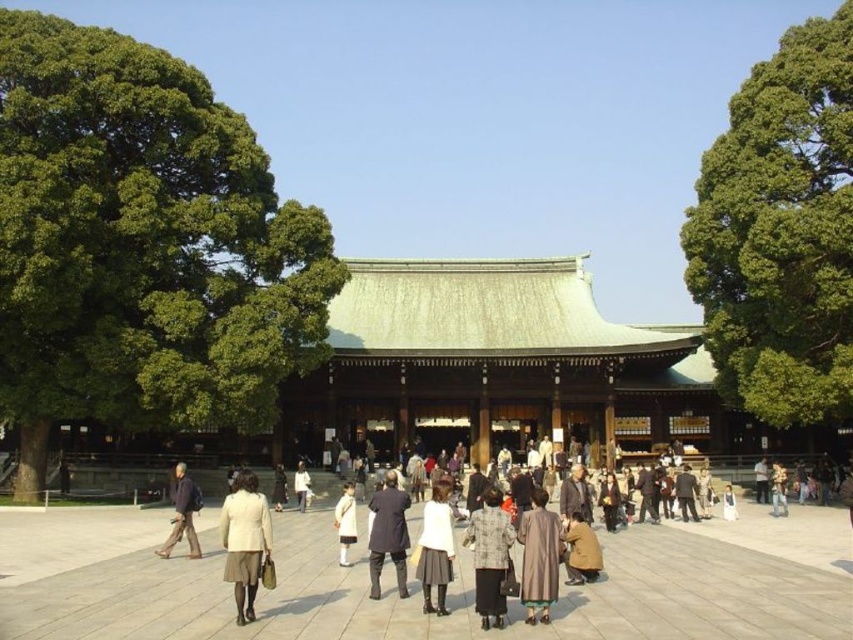
You are a photographer positioned at the entrance of the shrine. You want to take a photo of both the brown textured coat at center and the white matte coat at center. Which coat should you adjust to ensure both are fully visible in the photo?

The brown textured coat at center is in front of the white matte coat at center, so you should move the brown textured coat at center slightly backward to ensure both coats are fully visible in the photo.

You are a photographer at the event and want to capture both the light beige skirt at center and the brown textured coat at center in the same frame. Which object should you focus on first to ensure both are in the shot?

You should focus on the brown textured coat at center first because the light beige skirt at center is positioned under it, so adjusting the camera angle to include the lower area where the skirt is located will naturally include the coat above.